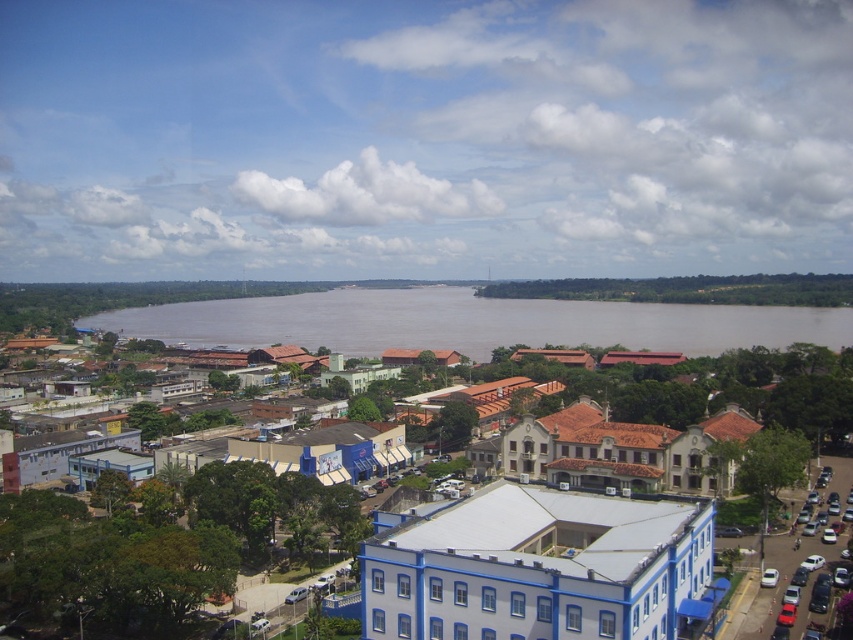
At what (x,y) coordinates should I click in order to perform the action: click on white matte building at center. Please return your answer as a coordinate pair (x, y). The width and height of the screenshot is (853, 640). Looking at the image, I should click on (692, 435).

What do you see at coordinates (692, 435) in the screenshot? The height and width of the screenshot is (640, 853). I see `white matte building at center` at bounding box center [692, 435].

I want to click on white matte building at center, so click(692, 435).